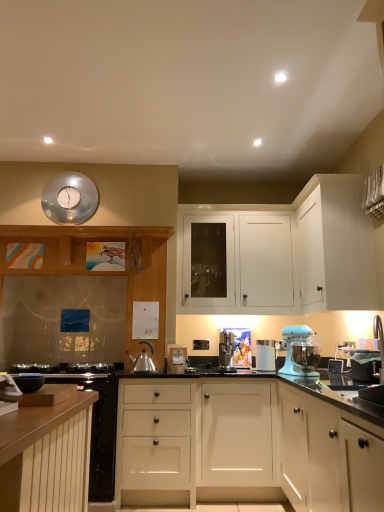
Question: Is wooden cabinet at left, the 5th cabinetry positioned from the front, facing towards matte white cabinet at lower right, which ranks as the 6th cabinetry in back-to-front order?

Choices:
 (A) yes
 (B) no

Answer: (B)

Question: Considering the relative positions of wooden cabinet at left, the 2th cabinetry in the back-to-front sequence, and matte white cabinet at lower right, acting as the 1th cabinetry starting from the front, in the image provided, is wooden cabinet at left, the 2th cabinetry in the back-to-front sequence, in front of matte white cabinet at lower right, acting as the 1th cabinetry starting from the front,?

Choices:
 (A) no
 (B) yes

Answer: (A)

Question: Is wooden cabinet at left, the 2th cabinetry in the back-to-front sequence, shorter than matte white cabinet at lower right, which ranks as the 6th cabinetry in back-to-front order?

Choices:
 (A) no
 (B) yes

Answer: (A)

Question: Is matte white cabinet at lower right, which ranks as the 6th cabinetry in back-to-front order, at the back of wooden cabinet at left, the 2th cabinetry in the back-to-front sequence?

Choices:
 (A) no
 (B) yes

Answer: (A)

Question: Is wooden cabinet at left, the 2th cabinetry in the back-to-front sequence, far from matte white cabinet at lower right, which ranks as the 6th cabinetry in back-to-front order?

Choices:
 (A) no
 (B) yes

Answer: (B)

Question: Relative to matte silver toaster at center, which is the first appliance in right-to-left order, is wooden cabinet at left, the 5th cabinetry positioned from the front, in front or behind?

Choices:
 (A) behind
 (B) front

Answer: (A)

Question: From a real-world perspective, relative to matte silver toaster at center, which is the first appliance in right-to-left order, is wooden cabinet at left, the 5th cabinetry positioned from the front, vertically above or below?

Choices:
 (A) below
 (B) above

Answer: (B)

Question: Is wooden cabinet at left, the 5th cabinetry positioned from the front, taller or shorter than matte silver toaster at center, which is the first appliance in right-to-left order?

Choices:
 (A) tall
 (B) short

Answer: (A)

Question: In terms of size, does wooden cabinet at left, the 5th cabinetry positioned from the front, appear bigger or smaller than matte silver toaster at center, which is the first appliance in right-to-left order?

Choices:
 (A) big
 (B) small

Answer: (A)

Question: Choose the correct answer: Is wooden cabinet at left, the 2th cabinetry in the back-to-front sequence, inside white plastic container at center, acting as the first kitchen appliance starting from the right, or outside it?

Choices:
 (A) inside
 (B) outside

Answer: (B)

Question: In terms of width, does wooden cabinet at left, the 5th cabinetry positioned from the front, look wider or thinner when compared to white plastic container at center, which ranks as the 2th kitchen appliance in left-to-right order?

Choices:
 (A) wide
 (B) thin

Answer: (A)

Question: From the image's perspective, is wooden cabinet at left, the 2th cabinetry in the back-to-front sequence, positioned above or below white plastic container at center, acting as the first kitchen appliance starting from the right?

Choices:
 (A) above
 (B) below

Answer: (A)

Question: Is wooden cabinet at left, the 5th cabinetry positioned from the front, to the left or to the right of white plastic container at center, which ranks as the 2th kitchen appliance in left-to-right order, in the image?

Choices:
 (A) left
 (B) right

Answer: (A)

Question: Is satin silver coffee machine at center, positioned as the 1th kitchen appliance in left-to-right order, inside or outside of white matte cabinet at upper right, the second cabinetry in the front-to-back sequence?

Choices:
 (A) outside
 (B) inside

Answer: (A)

Question: Considering the positions of point (220, 343) and point (339, 193), is point (220, 343) closer or farther from the camera than point (339, 193)?

Choices:
 (A) farther
 (B) closer

Answer: (A)